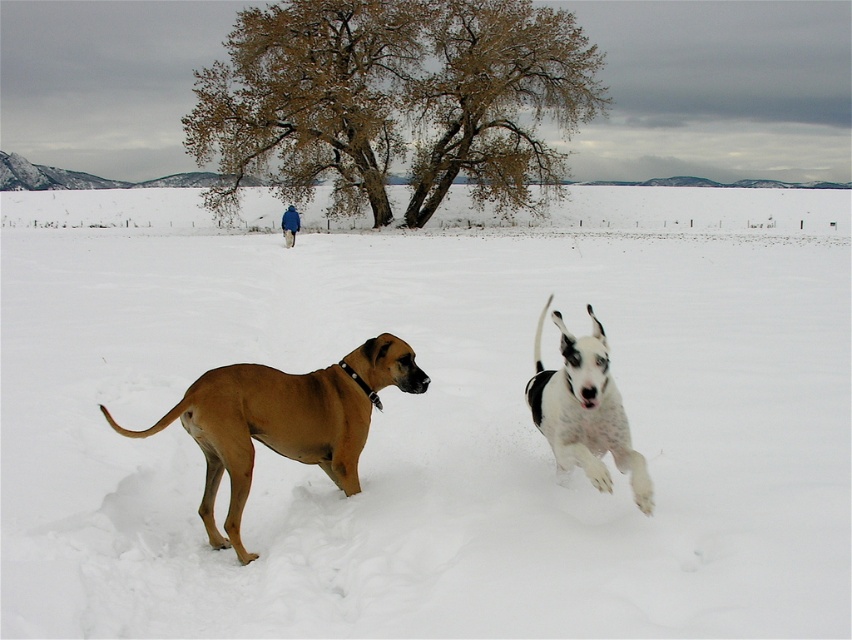
You are an observer looking at the winter scene. You see the brown leafy tree at upper center and the white speckled fur at center. Which object is positioned to the left of the other?

The brown leafy tree at upper center is to the left of white speckled fur at center.

Looking at this image, you are a photographer trying to capture the perfect shot of the two dogs in the winter scene. You notice the white fluffy snow at center and the white speckled fur at center. Which of these two elements might occupy more horizontal space in your photo?

The white fluffy snow at center might be wider than white speckled fur at center, so the snow could occupy more horizontal space in the photo.